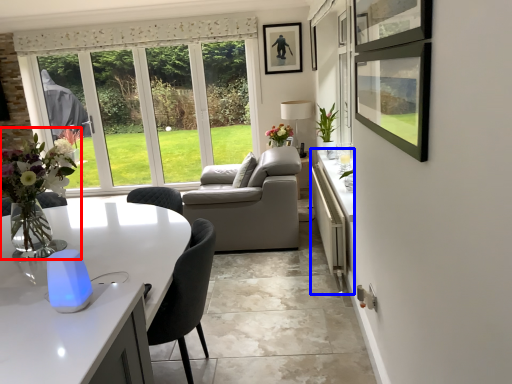
Question: Which point is closer to the camera, floral arrangement (highlighted by a red box) or counter (highlighted by a blue box)?

Choices:
 (A) floral arrangement
 (B) counter

Answer: (A)